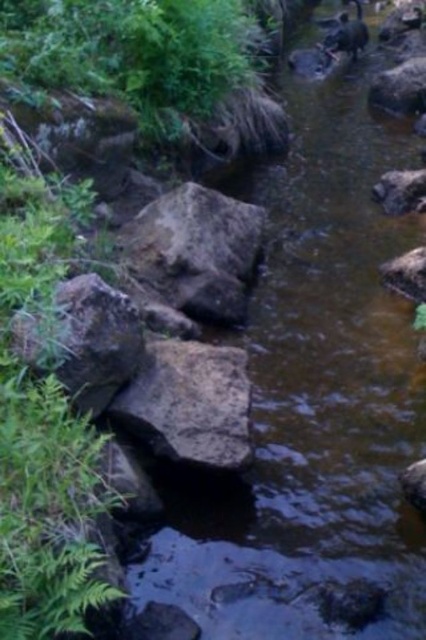
Between gray rough rock at lower left and brown furry animal at upper center, which one is positioned higher?

brown furry animal at upper center is higher up.

Which is in front, point (23, 316) or point (367, 42)?

Positioned in front is point (23, 316).

Is point (103, 355) closer to viewer compared to point (359, 17)?

That is True.

Find the location of `gray rough rock at lower left`. gray rough rock at lower left is located at coordinates (83, 339).

Between brown rough rock at center and gray rough rock at lower left, which one is positioned lower?

Positioned lower is brown rough rock at center.

Can you confirm if brown rough rock at center is positioned above gray rough rock at lower left?

Incorrect, brown rough rock at center is not positioned above gray rough rock at lower left.

What do you see at coordinates (189, 403) in the screenshot? This screenshot has width=426, height=640. I see `brown rough rock at center` at bounding box center [189, 403].

At what (x,y) coordinates should I click in order to perform the action: click on brown rough rock at center. Please return your answer as a coordinate pair (x, y). The height and width of the screenshot is (640, 426). Looking at the image, I should click on (189, 403).

Who is taller, rough stone boulder at center or gray rough rock at lower left?

rough stone boulder at center

Does rough stone boulder at center have a smaller size compared to gray rough rock at lower left?

Actually, rough stone boulder at center might be larger than gray rough rock at lower left.

Describe the element at coordinates (195, 252) in the screenshot. Image resolution: width=426 pixels, height=640 pixels. I see `rough stone boulder at center` at that location.

The height and width of the screenshot is (640, 426). What are the coordinates of `rough stone boulder at center` in the screenshot? It's located at (195, 252).